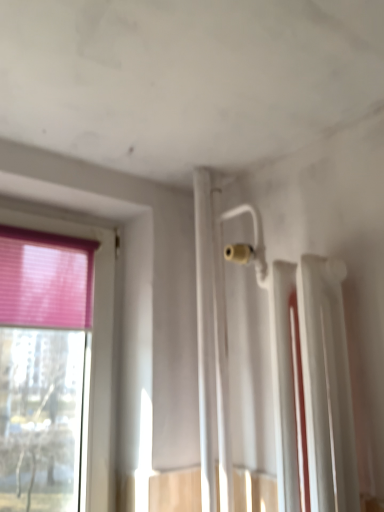
Question: From their relative heights in the image, would you say white glossy radiator at upper right is taller or shorter than pink fabric curtain at left?

Choices:
 (A) short
 (B) tall

Answer: (B)

Question: From the image's perspective, relative to pink fabric curtain at left, is white glossy radiator at upper right above or below?

Choices:
 (A) below
 (B) above

Answer: (A)

Question: From a real-world perspective, is white glossy radiator at upper right positioned above or below pink fabric curtain at left?

Choices:
 (A) below
 (B) above

Answer: (A)

Question: Is pink fabric curtain at left bigger or smaller than white glossy radiator at upper right?

Choices:
 (A) big
 (B) small

Answer: (B)

Question: Is pink fabric curtain at left wider or thinner than white glossy radiator at upper right?

Choices:
 (A) thin
 (B) wide

Answer: (A)

Question: Is pink fabric curtain at left inside or outside of white glossy radiator at upper right?

Choices:
 (A) outside
 (B) inside

Answer: (A)

Question: Is pink fabric curtain at left taller or shorter than white glossy radiator at upper right?

Choices:
 (A) tall
 (B) short

Answer: (B)